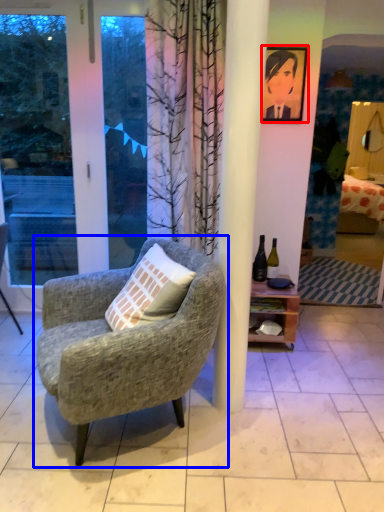
Question: Among these objects, which one is farthest to the camera, picture frame (highlighted by a red box) or chair (highlighted by a blue box)?

Choices:
 (A) picture frame
 (B) chair

Answer: (A)